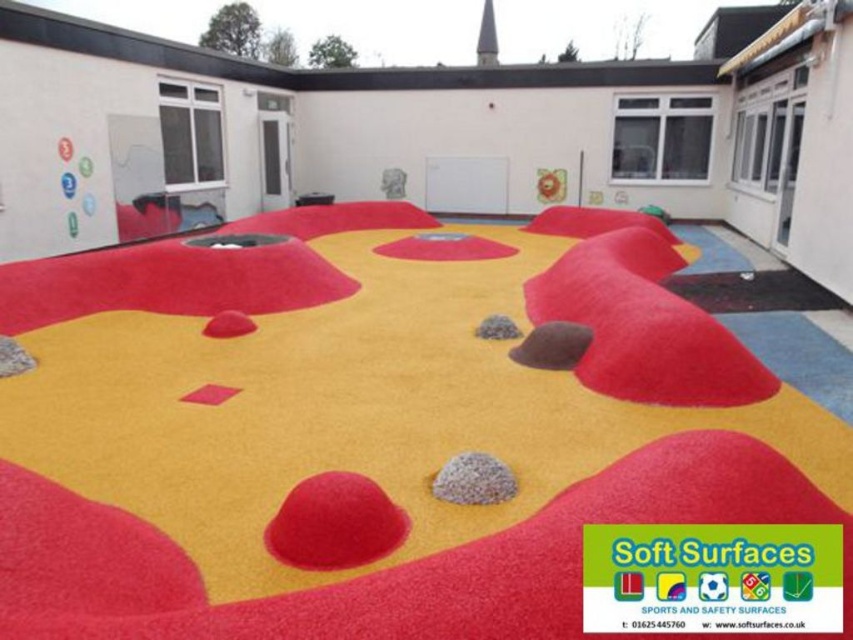
Question: Considering the relative positions of brown gravel at center and gray gravel at center in the image provided, where is brown gravel at center located with respect to gray gravel at center?

Choices:
 (A) below
 (B) above

Answer: (A)

Question: Which of the following is the farthest from the observer?

Choices:
 (A) (86, 435)
 (B) (556, 342)
 (C) (474, 326)
 (D) (477, 477)

Answer: (C)

Question: Can you confirm if yellow soft textured mat at center is thinner than gray gravel stone at center?

Choices:
 (A) no
 (B) yes

Answer: (A)

Question: Is the position of gray gravel stone at center more distant than that of brown gravel at center?

Choices:
 (A) no
 (B) yes

Answer: (A)

Question: Which of the following is the closest to the observer?

Choices:
 (A) (495, 470)
 (B) (64, 435)

Answer: (A)

Question: Estimate the real-world distances between objects in this image. Which object is farther from the gray gravel stone at center?

Choices:
 (A) gray gravel at center
 (B) yellow soft textured mat at center

Answer: (A)